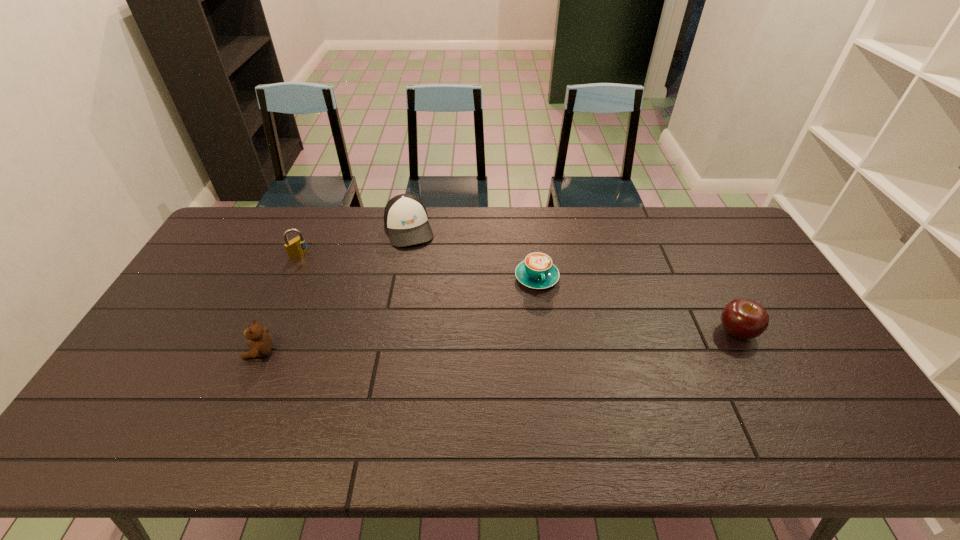
Where is `object situated at the right edge`? The image size is (960, 540). object situated at the right edge is located at coordinates (744, 319).

Identify the location of free region at the far edge of the desktop. This screenshot has width=960, height=540. (491, 206).

The width and height of the screenshot is (960, 540). In the image, there is a desktop. Identify the location of vacant region at the left edge. (217, 306).

The height and width of the screenshot is (540, 960). In order to click on free space at the far right corner of the desktop in this screenshot , I will do `click(693, 221)`.

This screenshot has width=960, height=540. In the image, there is a desktop. Identify the location of vacant space at the near right corner. (854, 404).

Locate an element on the screen. vacant point located between the shortest object and the third object from right to left is located at coordinates (473, 253).

At what (x,y) coordinates should I click in order to perform the action: click on free space that is in between the apple and the shortest object. Please return your answer as a coordinate pair (x, y). Image resolution: width=960 pixels, height=540 pixels. Looking at the image, I should click on (636, 305).

The width and height of the screenshot is (960, 540). What are the coordinates of `vacant point located between the second object from right to left and the teddy bear` in the screenshot? It's located at (398, 315).

You are a GUI agent. You are given a task and a screenshot of the screen. Output one action in this format:
    pyautogui.click(x=<x>, y=<y>)
    Task: Click on the free space between the rightmost object and the third nearest object
    The height and width of the screenshot is (540, 960).
    Given the screenshot: What is the action you would take?
    pyautogui.click(x=636, y=305)

Locate an element on the screen. The width and height of the screenshot is (960, 540). empty space between the apple and the cap is located at coordinates 572,280.